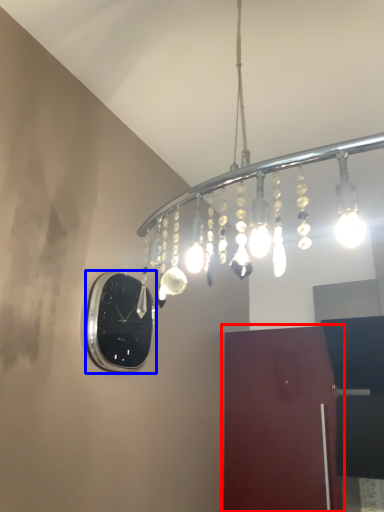
Question: Which point is closer to the camera, door (highlighted by a red box) or clock (highlighted by a blue box)?

Choices:
 (A) door
 (B) clock

Answer: (B)